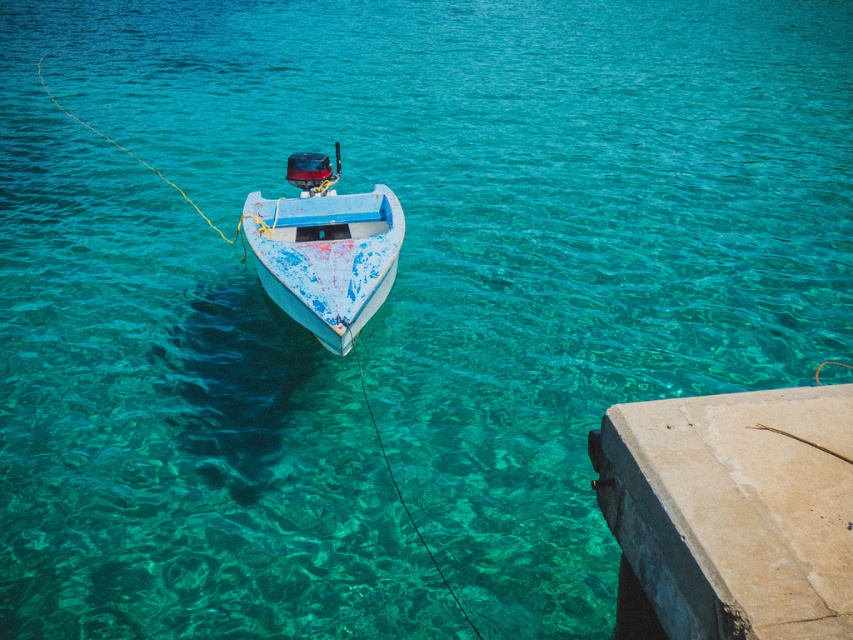
This screenshot has width=853, height=640. Describe the element at coordinates (733, 509) in the screenshot. I see `concrete at lower right` at that location.

Is concrete at lower right wider than painted wood boat at center?

No, concrete at lower right is not wider than painted wood boat at center.

You are a GUI agent. You are given a task and a screenshot of the screen. Output one action in this format:
    pyautogui.click(x=<x>, y=<y>)
    Task: Click on the concrete at lower right
    
    Given the screenshot: What is the action you would take?
    pyautogui.click(x=733, y=509)